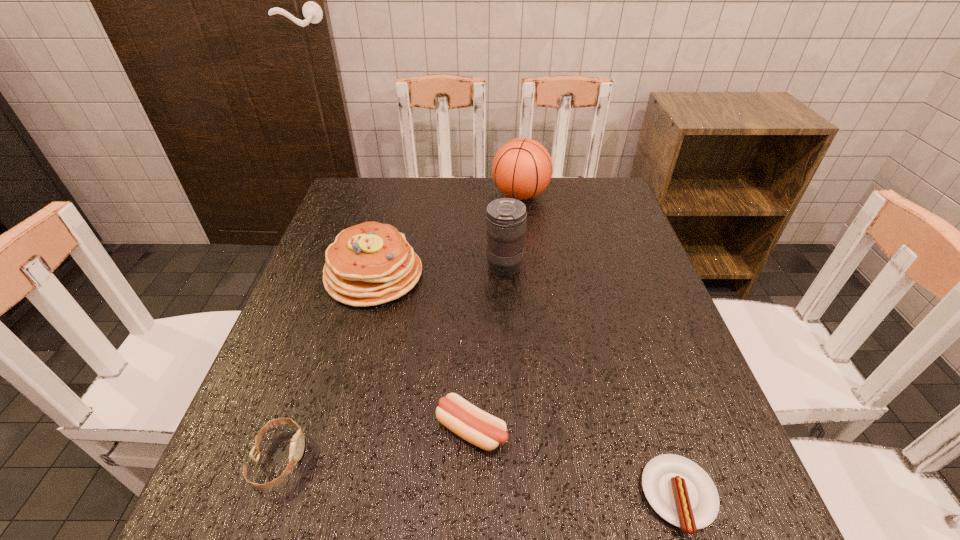
At what (x,y) coordinates should I click in order to perform the action: click on free space located on the side of the telephoto lens where the control switches are located. Please return your answer as a coordinate pair (x, y). The width and height of the screenshot is (960, 540). Looking at the image, I should click on (327, 266).

Where is `free space located 0.230m on the front of the fourth shortest object`? This screenshot has width=960, height=540. free space located 0.230m on the front of the fourth shortest object is located at coordinates (341, 401).

The height and width of the screenshot is (540, 960). I want to click on free point located 0.160m on the face of the watch, so click(398, 458).

Locate an element on the screen. The width and height of the screenshot is (960, 540). vacant space located 0.340m on the right of the left sausage is located at coordinates (702, 430).

Identify the location of vacant position located on the right of the shortest object. The height and width of the screenshot is (540, 960). (748, 496).

Locate an element on the screen. The width and height of the screenshot is (960, 540). object situated at the far edge is located at coordinates (522, 168).

Where is `watch located at the near edge`? The width and height of the screenshot is (960, 540). watch located at the near edge is located at coordinates (297, 444).

Locate an element on the screen. This screenshot has width=960, height=540. sausage that is at the near edge is located at coordinates (679, 490).

At what (x,y) coordinates should I click in order to perform the action: click on pancake that is positioned at the left edge. Please return your answer as a coordinate pair (x, y). Image resolution: width=960 pixels, height=540 pixels. Looking at the image, I should click on (371, 263).

At what (x,y) coordinates should I click in order to perform the action: click on watch present at the left edge. Please return your answer as a coordinate pair (x, y). The image size is (960, 540). Looking at the image, I should click on (297, 444).